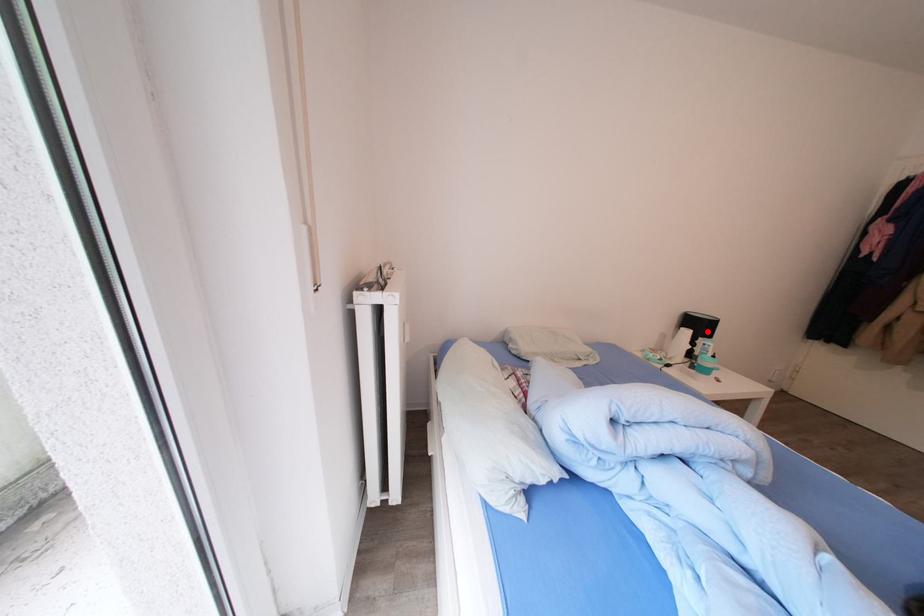
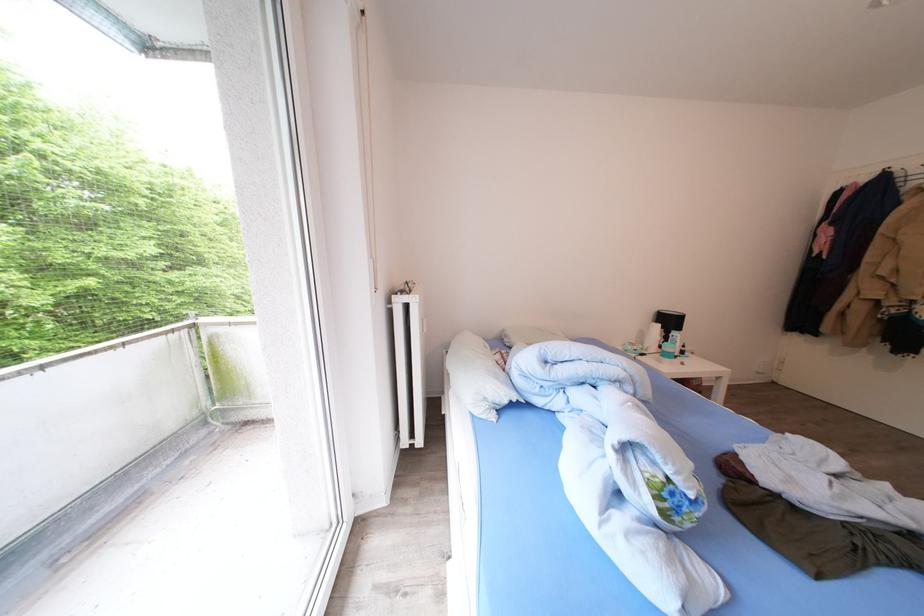
Locate, in the second image, the point that corresponds to the highlighted location in the first image.

(677, 326)